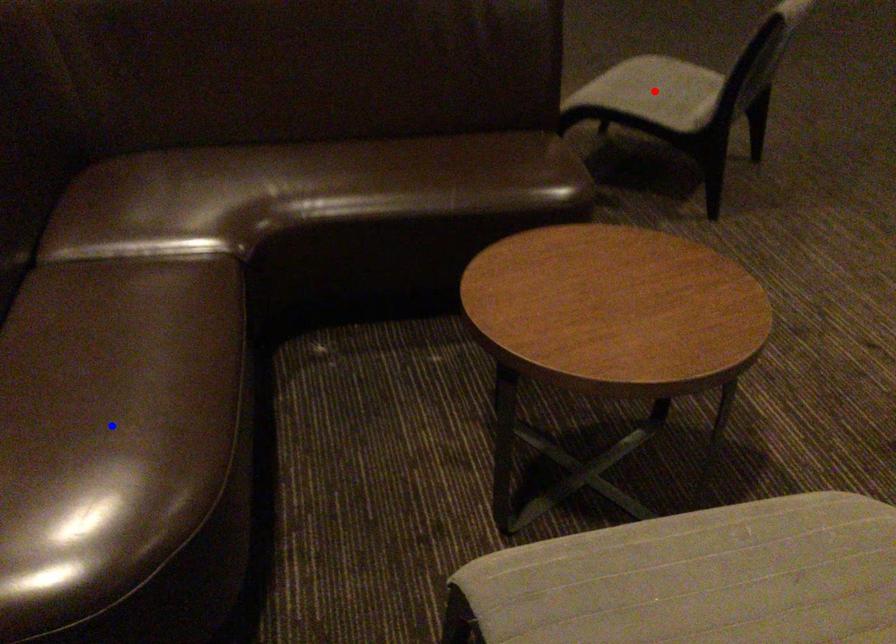
Question: In the image, two points are highlighted. Which point is nearer to the camera? Reply with the corresponding letter.

Choices:
 (A) blue point
 (B) red point

Answer: (A)